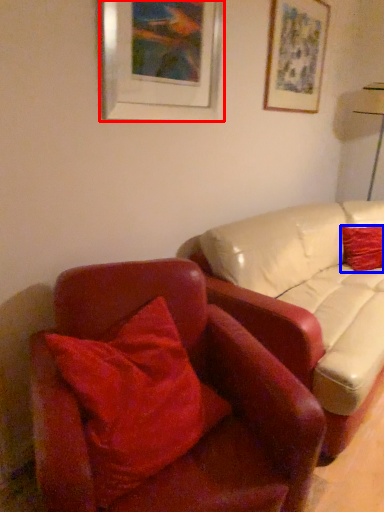
Question: Which object appears farthest to the camera in this image, picture frame (highlighted by a red box) or pillow (highlighted by a blue box)?

Choices:
 (A) picture frame
 (B) pillow

Answer: (B)